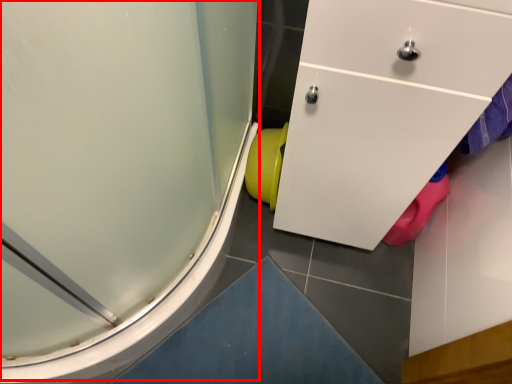
Question: Observing the image, what is the correct spatial positioning of shower door (annotated by the red box) in reference to toilet bowl?

Choices:
 (A) left
 (B) right

Answer: (A)